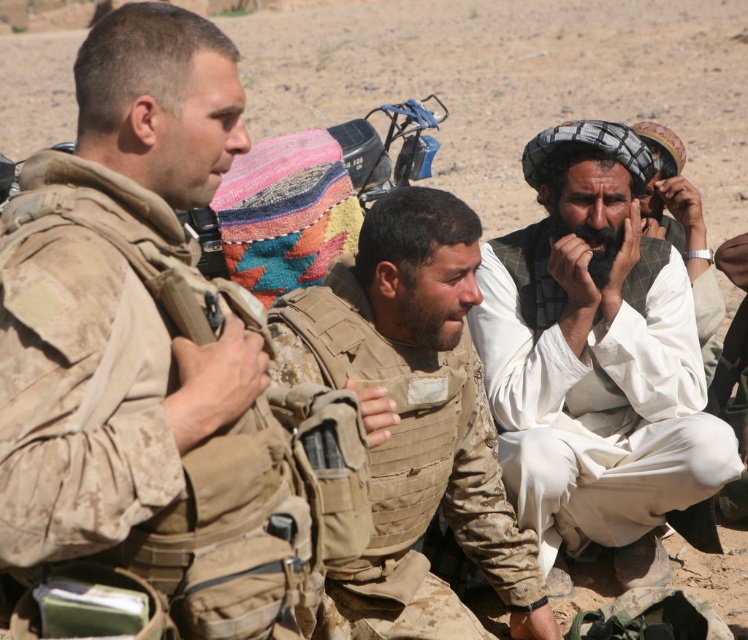
Question: Is camouflage uniform at center positioned behind white woven hat at upper right?

Choices:
 (A) no
 (B) yes

Answer: (A)

Question: Which point is closer to the camera?

Choices:
 (A) (512, 237)
 (B) (652, 202)

Answer: (A)

Question: Which point is closer to the camera?

Choices:
 (A) camouflage uniform at center
 (B) white cotton robe at right
 (C) white woven hat at upper right

Answer: (A)

Question: Which object is the closest to the white cotton robe at right?

Choices:
 (A) white woven hat at upper right
 (B) camouflage uniform at left
 (C) camouflage uniform at center

Answer: (C)

Question: Is camouflage uniform at center closer to camera compared to white woven hat at upper right?

Choices:
 (A) no
 (B) yes

Answer: (B)

Question: Does white cotton robe at right appear on the right side of white woven hat at upper right?

Choices:
 (A) no
 (B) yes

Answer: (A)